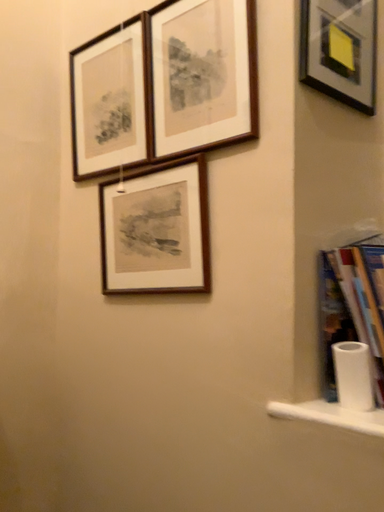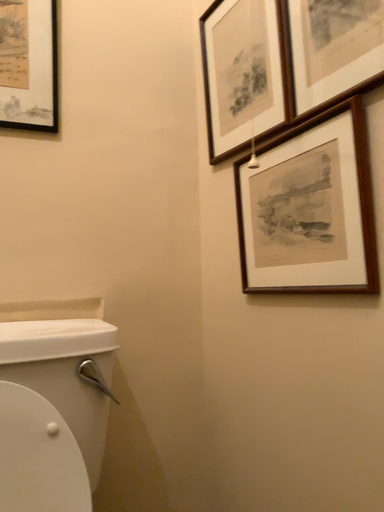
Question: How did the camera likely rotate when shooting the video?

Choices:
 (A) rotated right
 (B) rotated left

Answer: (B)